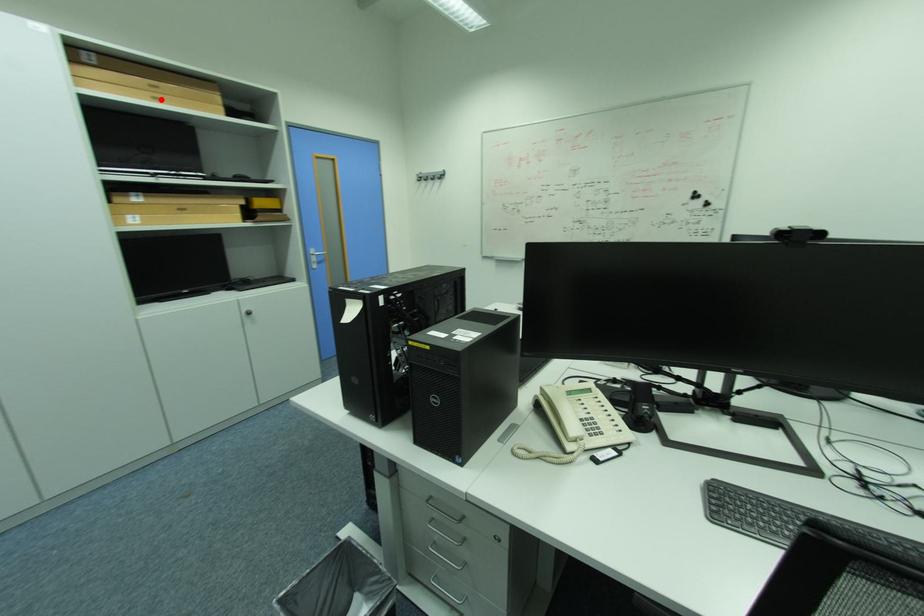
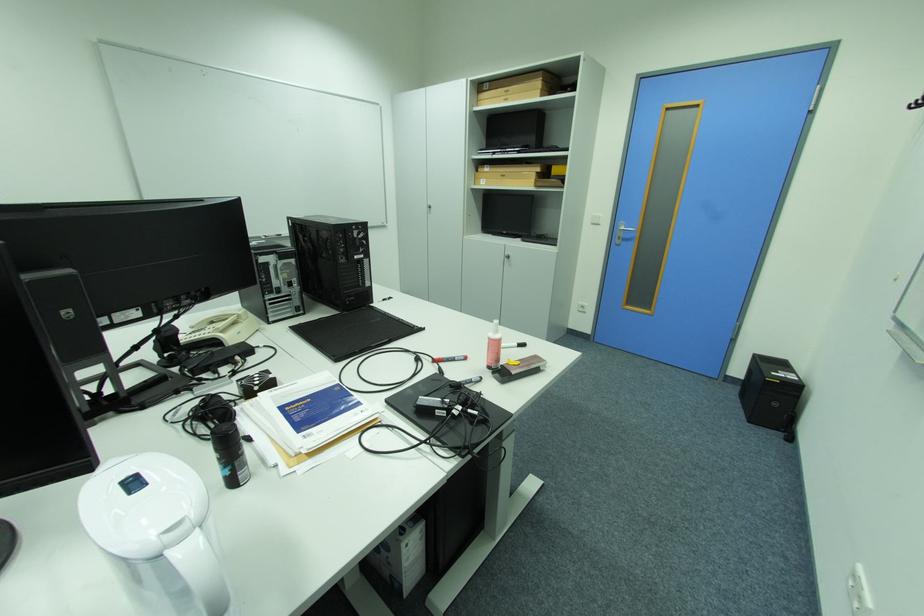
The point at the highlighted location is marked in the first image. Where is the corresponding point in the second image?

(514, 100)